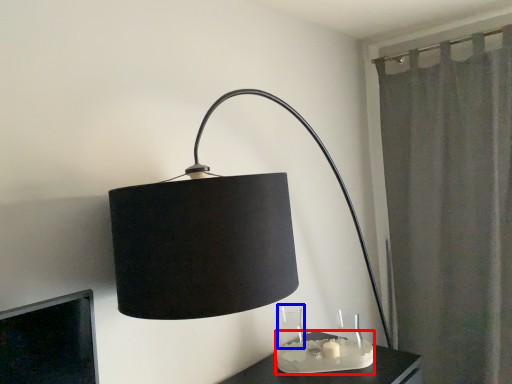
Question: Which object appears closest to the camera in this image, candle holder (highlighted by a red box) or glass vase (highlighted by a blue box)?

Choices:
 (A) candle holder
 (B) glass vase

Answer: (A)